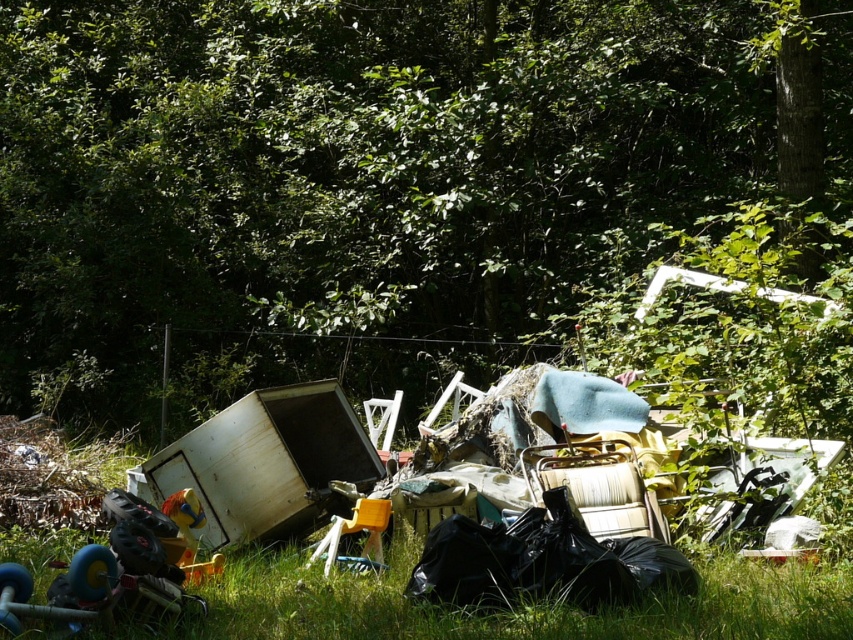
Question: Estimate the real-world distances between objects in this image. Which object is closer to the green leafy tree at upper center?

Choices:
 (A) black plastic bag at center
 (B) green grass at lower center

Answer: (A)

Question: Which of the following is the farthest from the observer?

Choices:
 (A) black plastic bag at center
 (B) green grass at lower center

Answer: (A)

Question: Which object is the closest to the green grass at lower center?

Choices:
 (A) black plastic bag at center
 (B) green leafy tree at upper center

Answer: (A)

Question: Is green grass at lower center to the left of black plastic bag at center from the viewer's perspective?

Choices:
 (A) yes
 (B) no

Answer: (A)

Question: Does green leafy tree at upper center have a greater width compared to green grass at lower center?

Choices:
 (A) yes
 (B) no

Answer: (B)

Question: Considering the relative positions of green leafy tree at upper center and green grass at lower center in the image provided, where is green leafy tree at upper center located with respect to green grass at lower center?

Choices:
 (A) right
 (B) left

Answer: (A)